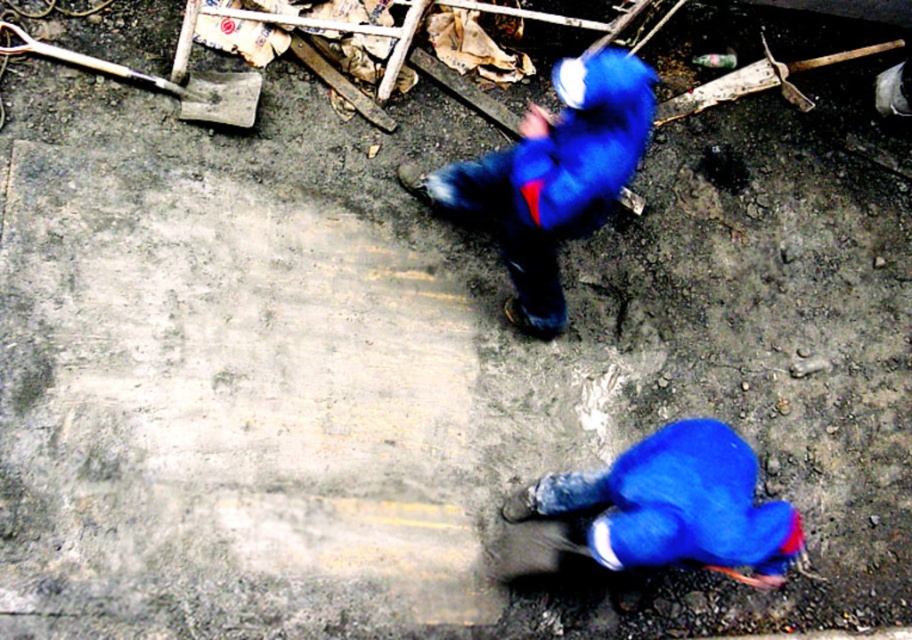
What do you see at coordinates (553, 176) in the screenshot? I see `blue fuzzy jacket at upper center` at bounding box center [553, 176].

Who is taller, blue fuzzy jacket at upper center or metallic silver shovel at upper left?

blue fuzzy jacket at upper center is taller.

Image resolution: width=912 pixels, height=640 pixels. In order to click on blue fuzzy jacket at upper center in this screenshot , I will do point(553,176).

Locate an element on the screen. The height and width of the screenshot is (640, 912). blue fuzzy jacket at upper center is located at coordinates (553, 176).

Which is behind, point (579, 496) or point (607, 134)?

Point (579, 496)

Does blue fabric construction worker at lower right appear on the right side of blue fuzzy jacket at upper center?

Yes, blue fabric construction worker at lower right is to the right of blue fuzzy jacket at upper center.

Looking at this image, measure the distance between point (x=774, y=579) and camera.

13.31 feet

You are a GUI agent. You are given a task and a screenshot of the screen. Output one action in this format:
    pyautogui.click(x=<x>, y=<y>)
    Task: Click on the blue fabric construction worker at lower right
    
    Given the screenshot: What is the action you would take?
    point(660,509)

Looking at this image, who is shorter, blue fabric construction worker at lower right or metallic silver shovel at upper left?

metallic silver shovel at upper left is shorter.

Between point (637, 512) and point (9, 51), which one is positioned in front?

Point (637, 512) is more forward.

Which is in front, point (700, 534) or point (57, 52)?

Point (700, 534) is in front.

Locate an element on the screen. This screenshot has height=640, width=912. blue fabric construction worker at lower right is located at coordinates (660, 509).